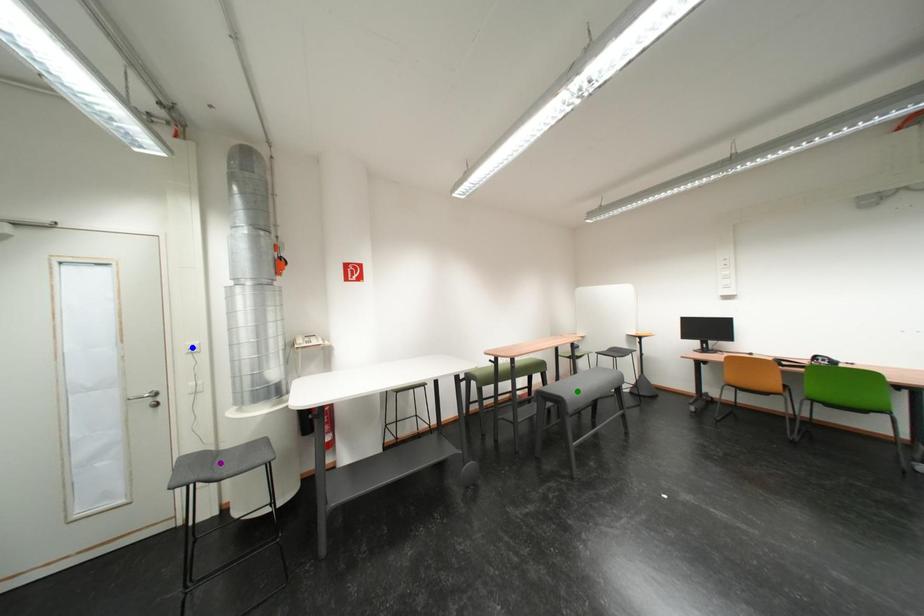
Order these from nearest to farthest:
A) purple point
B) green point
C) blue point

1. purple point
2. blue point
3. green point